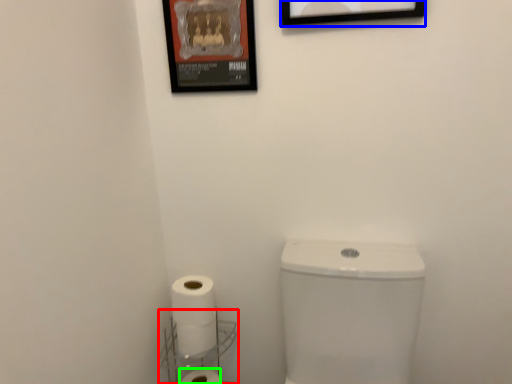
Question: Which object is the farthest from shelf (highlighted by a red box)? Choose among these: picture frame (highlighted by a blue box) or toilet paper (highlighted by a green box).

Choices:
 (A) picture frame
 (B) toilet paper

Answer: (A)